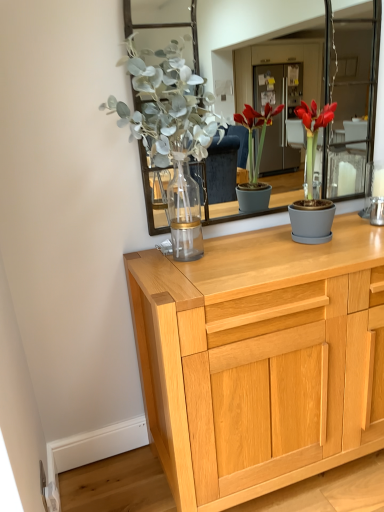
Question: From the image's perspective, does matte gray pot at center appear higher than light oak wooden chest of drawers at center?

Choices:
 (A) no
 (B) yes

Answer: (B)

Question: Is matte gray pot at center not close to light oak wooden chest of drawers at center?

Choices:
 (A) yes
 (B) no

Answer: (B)

Question: Is matte gray pot at center shorter than light oak wooden chest of drawers at center?

Choices:
 (A) no
 (B) yes

Answer: (B)

Question: Is light oak wooden chest of drawers at center a part of matte gray pot at center?

Choices:
 (A) no
 (B) yes

Answer: (A)

Question: Is matte gray pot at center located outside light oak wooden chest of drawers at center?

Choices:
 (A) no
 (B) yes

Answer: (B)

Question: Considering the relative positions of matte gray pot at center and light oak wooden chest of drawers at center in the image provided, is matte gray pot at center to the left of light oak wooden chest of drawers at center from the viewer's perspective?

Choices:
 (A) no
 (B) yes

Answer: (A)

Question: From a real-world perspective, does light oak wooden chest of drawers at center sit lower than matte gray pot at center?

Choices:
 (A) no
 (B) yes

Answer: (B)

Question: Can you confirm if light oak wooden chest of drawers at center is smaller than matte gray pot at center?

Choices:
 (A) yes
 (B) no

Answer: (B)

Question: From the image's perspective, does light oak wooden chest of drawers at center appear higher than matte gray pot at center?

Choices:
 (A) no
 (B) yes

Answer: (A)

Question: Would you say light oak wooden chest of drawers at center is a long distance from matte gray pot at center?

Choices:
 (A) no
 (B) yes

Answer: (A)

Question: Considering the relative positions of light oak wooden chest of drawers at center and matte gray pot at center in the image provided, is light oak wooden chest of drawers at center to the left of matte gray pot at center from the viewer's perspective?

Choices:
 (A) yes
 (B) no

Answer: (A)

Question: Is matte gray pot at center at the back of light oak wooden chest of drawers at center?

Choices:
 (A) no
 (B) yes

Answer: (A)

Question: Is matte gray pot at center in front of or behind light oak wooden chest of drawers at center in the image?

Choices:
 (A) front
 (B) behind

Answer: (B)